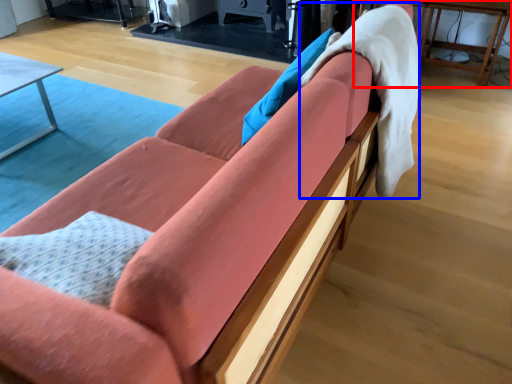
Question: Which point is further to the camera, table (highlighted by a red box) or blanket (highlighted by a blue box)?

Choices:
 (A) table
 (B) blanket

Answer: (A)